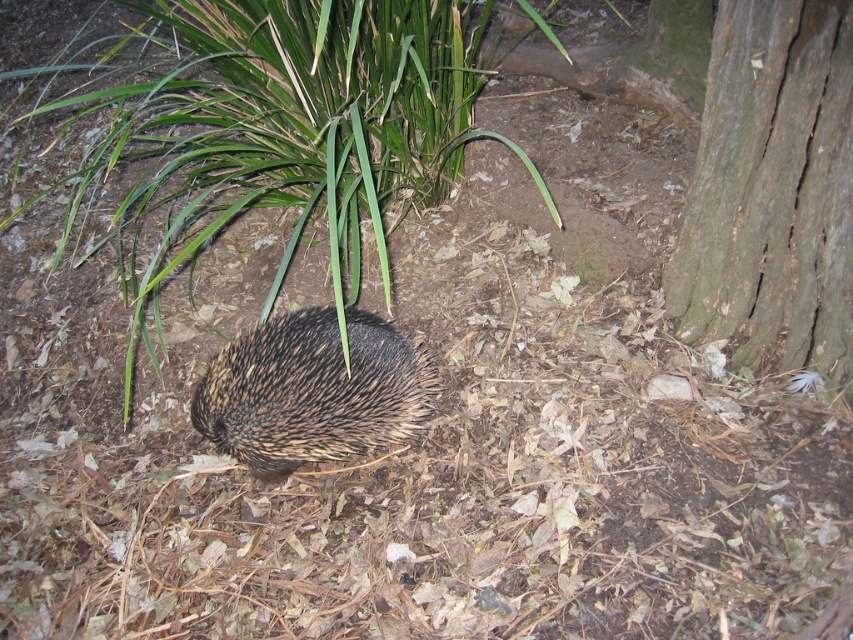
Question: Which of these objects is positioned farthest from the green leafy grass at center?

Choices:
 (A) dark brown rough bark at right
 (B) brown spiny hedgehog at center

Answer: (A)

Question: Which of the following is the farthest from the observer?

Choices:
 (A) pyautogui.click(x=424, y=154)
 (B) pyautogui.click(x=366, y=420)

Answer: (A)

Question: Which point is farther to the camera?

Choices:
 (A) brown spiny hedgehog at center
 (B) dark brown rough bark at right
 (C) green leafy grass at center

Answer: (A)

Question: From the image, what is the correct spatial relationship of green leafy grass at center in relation to brown spiny hedgehog at center?

Choices:
 (A) right
 (B) left

Answer: (B)

Question: Does dark brown rough bark at right appear over brown spiny hedgehog at center?

Choices:
 (A) no
 (B) yes

Answer: (B)

Question: Is green leafy grass at center above dark brown rough bark at right?

Choices:
 (A) no
 (B) yes

Answer: (B)